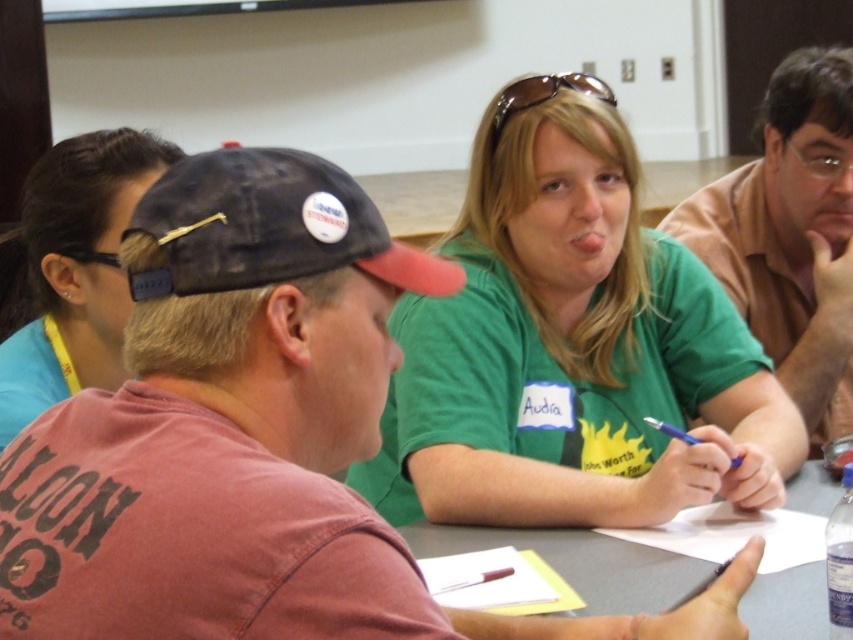
Question: Which point is farther from the camera taking this photo?

Choices:
 (A) (86, 200)
 (B) (283, 266)
 (C) (173, 280)
 (D) (653, 401)

Answer: (D)

Question: Is matte red cap at center above dark blue fabric baseball cap at center-left?

Choices:
 (A) yes
 (B) no

Answer: (B)

Question: Among these points, which one is farthest from the camera?

Choices:
 (A) (660, 428)
 (B) (511, 531)

Answer: (B)

Question: Which object is farther from the camera taking this photo?

Choices:
 (A) blue plastic pen at center
 (B) pink cotton shirt at upper right

Answer: (B)

Question: Is matte red cap at center to the left of blue fabric hair clip at upper left from the viewer's perspective?

Choices:
 (A) no
 (B) yes

Answer: (A)

Question: Is matte red cap at center to the left of green matte shirt at center from the viewer's perspective?

Choices:
 (A) yes
 (B) no

Answer: (A)